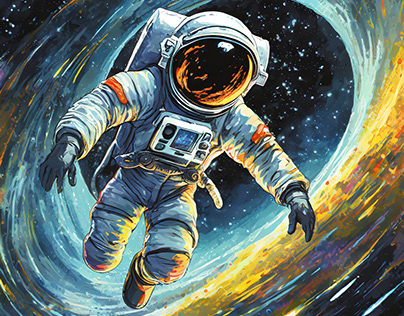
Find the location of `screen`. screen is located at coordinates tap(181, 139).